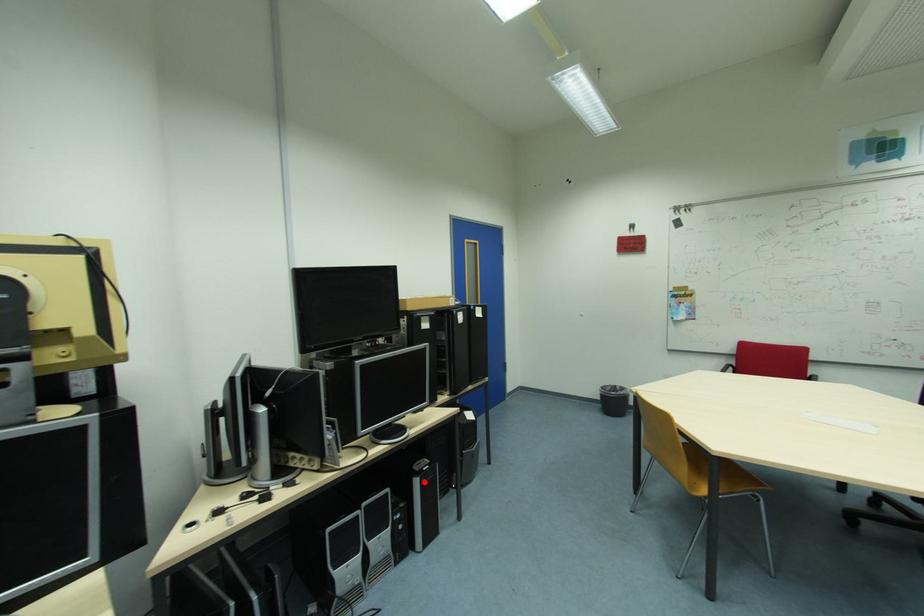
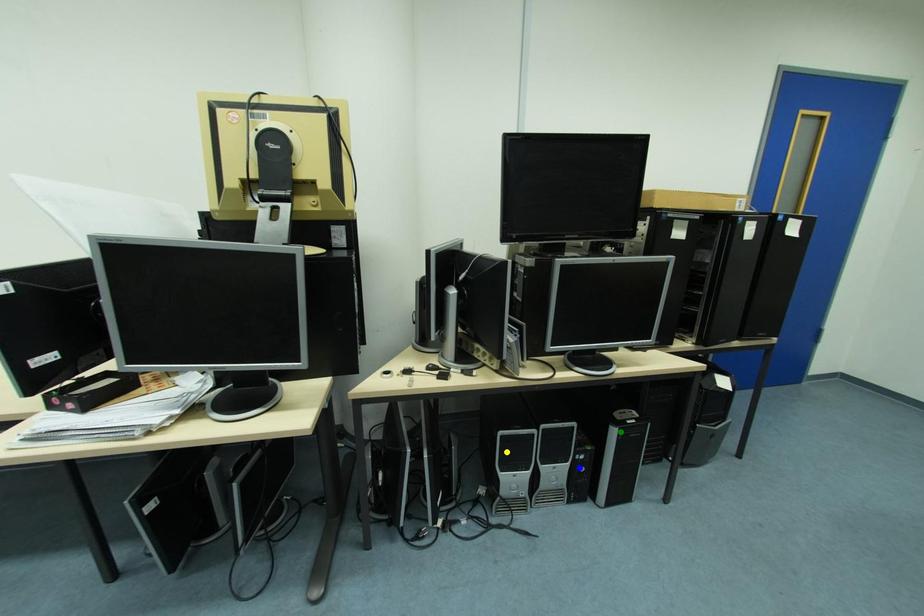
Question: I am providing you with two images of the same scene from different viewpoints. A red point is marked on the first image. You are given multiple points on the second image. Which mark in image 2 goes with the point in image 1?

Choices:
 (A) blue point
 (B) yellow point
 (C) green point

Answer: (C)